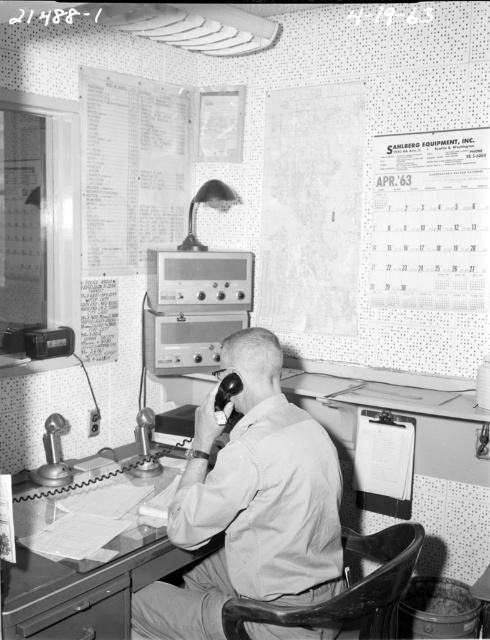
Consider the image. You are standing in the vintage office control room and need to reach a point behind both points labeled as point (165, 145) and point (352, 582). Can you determine which point you need to go around first to access the area behind both?

Since point (165, 145) is behind point (352, 582), you must first go around point (352, 582) to access the area behind both points.

You are an office worker in this vintage setting. You need to place a new document on the smooth wooden desk at center so that it can be easily seen from the matte glass lamp at upper center. Where should you position the document on the desk?

The smooth wooden desk at center is in front of the matte glass lamp at upper center, so placing the document in the center of the desk would ensure it is directly under the lamp, making it easily visible from the lamp.

You are standing in the vintage office control room and want to locate two specific points marked on the wall. The first point is at coordinates point (25, 552) and the second is at point (195, 216). Which point is closer to you when facing the wall?

Point (25, 552) is in front of point (195, 216), so it is closer to you when facing the wall.